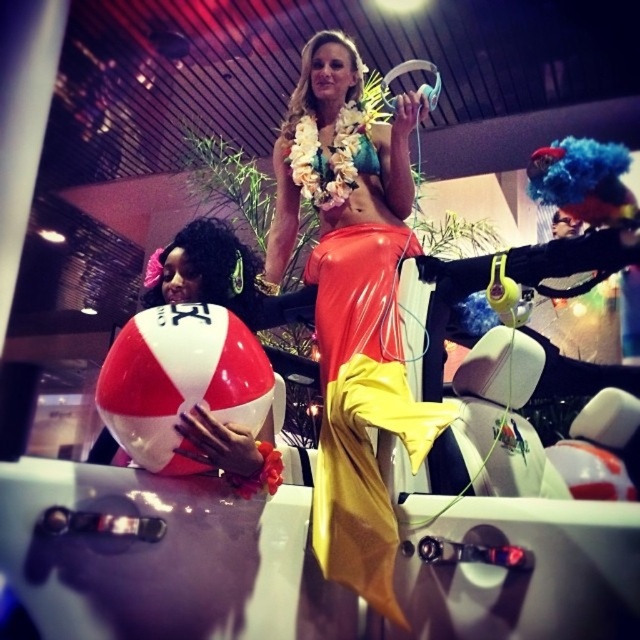
Question: Which of these objects is positioned closest to the blue fuzzy wig at upper right?

Choices:
 (A) white/red rubber beach ball at left
 (B) shiny orange latex dress at center

Answer: (B)

Question: Which object is closer to the camera taking this photo?

Choices:
 (A) shiny orange latex dress at center
 (B) white/red rubber beach ball at left
 (C) blue fuzzy wig at upper right

Answer: (A)

Question: Does shiny orange latex dress at center appear on the right side of white/red rubber beach ball at left?

Choices:
 (A) yes
 (B) no

Answer: (A)

Question: Is white/red rubber beach ball at left below blue fuzzy wig at upper right?

Choices:
 (A) yes
 (B) no

Answer: (A)

Question: Does shiny orange latex dress at center come in front of blue fuzzy wig at upper right?

Choices:
 (A) yes
 (B) no

Answer: (A)

Question: Which object is the farthest from the shiny orange latex dress at center?

Choices:
 (A) white/red rubber beach ball at left
 (B) blue fuzzy wig at upper right

Answer: (B)